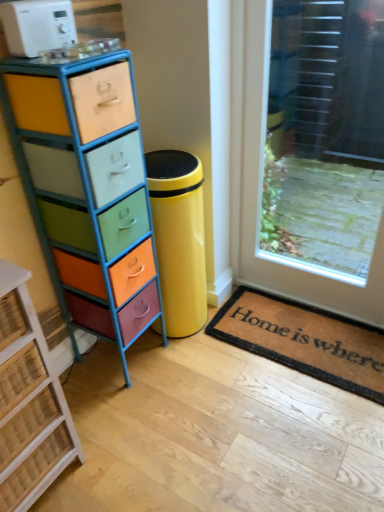
Identify the location of empty space that is in between rustic wicker chest of drawers at left, the second chest of drawers from the right, and multicolored painted wood chest of drawers at left, which is the 1th chest of drawers from right to left. (101, 404).